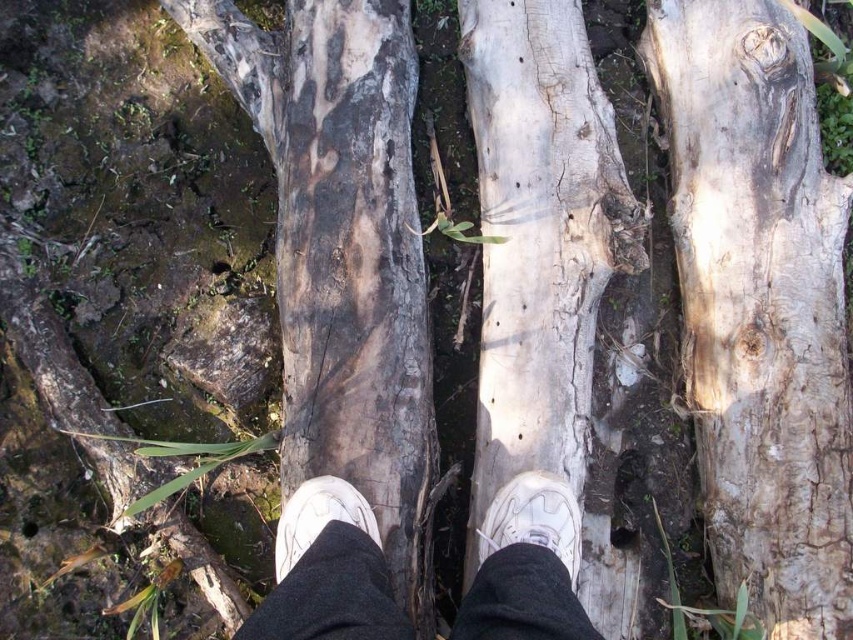
You are a hiker trying to cross a narrow wooden bridge. You notice the white cracked wood at center and the white matte shoe at center. How far apart are these two objects?

The white cracked wood at center is 21.01 inches from the white matte shoe at center.

You are trying to cross a narrow wooden bridge made of three logs. Your white matte shoe at center is on the middle log, which is made of white cracked wood at center. Do you think the log you are standing on can support your weight without bending? Consider the width of the log compared to your shoe.

The white cracked wood at center might be wider than the white matte shoe at center, so it is likely capable of supporting your weight without bending, as the log is wider than the shoe.

Based on the photo, you are standing on the wooden bridge and want to step onto the point marked at coordinates (688, 24). Given that your current position is 1.5 meters away from the viewer, can you reach this point without moving further forward?

The point marked at coordinates (688, 24) is 1.76 meters away from the viewer, while your current position is 1.5 meters away. Since the distance to the point is greater than your current position, you would need to move forward an additional 0.26 meters to reach it.